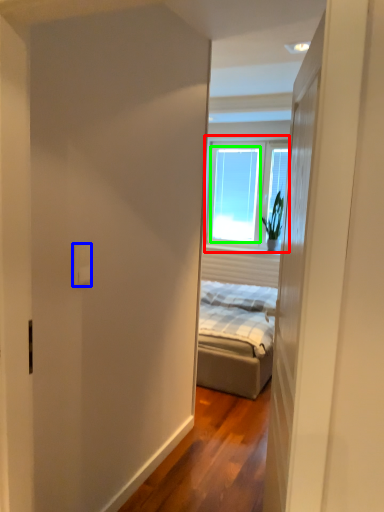
Question: Based on their relative distances, which object is nearer to window (highlighted by a red box)? Choose from electric outlet (highlighted by a blue box) and window (highlighted by a green box).

Choices:
 (A) electric outlet
 (B) window

Answer: (B)